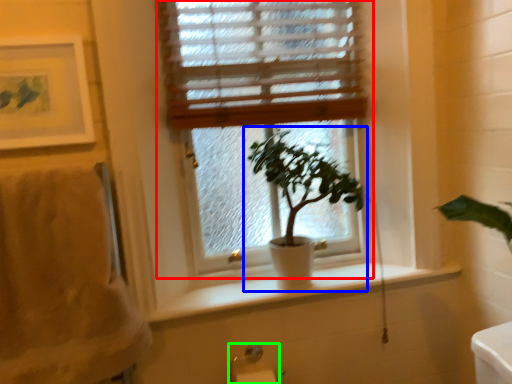
Question: Which object is positioned farthest from window (highlighted by a red box)? Select from houseplant (highlighted by a blue box) and towel bar (highlighted by a green box).

Choices:
 (A) houseplant
 (B) towel bar

Answer: (B)